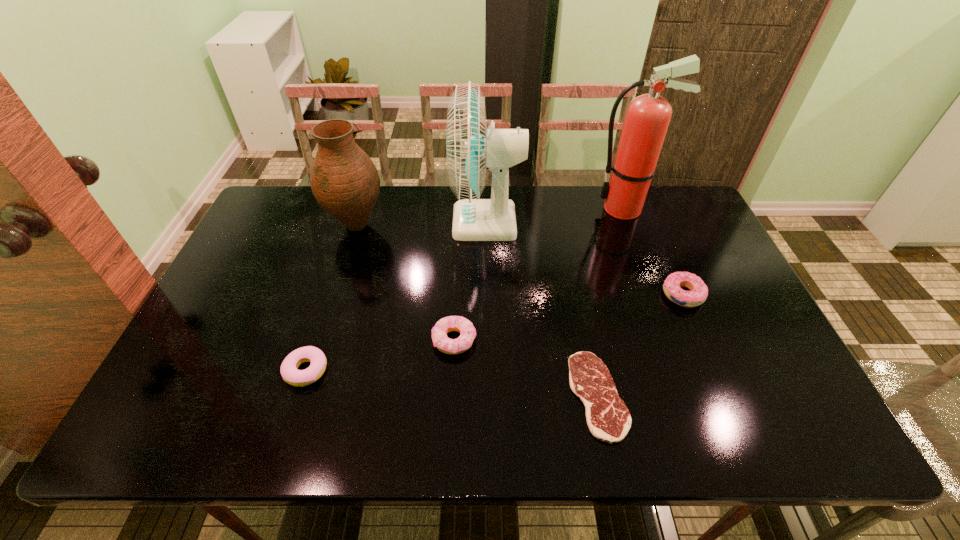
I want to click on vacant area located on the hose direction of the fire extinguisher, so click(x=486, y=209).

The width and height of the screenshot is (960, 540). I want to click on vacant region located 0.070m on the hose direction of the fire extinguisher, so click(x=569, y=209).

This screenshot has height=540, width=960. I want to click on vacant area located in front of the fan to face the airflow, so (335, 222).

I want to click on free spot located 0.390m in front of the fan to face the airflow, so click(x=332, y=222).

The width and height of the screenshot is (960, 540). Find the location of `free space located 0.390m in front of the fan to face the airflow`. free space located 0.390m in front of the fan to face the airflow is located at coordinates (332, 222).

Where is `free space located on the right of the vase`? This screenshot has height=540, width=960. free space located on the right of the vase is located at coordinates (419, 225).

What are the coordinates of `vacant space situated 0.320m on the front of the fourth farthest object` in the screenshot? It's located at (738, 425).

You are a GUI agent. You are given a task and a screenshot of the screen. Output one action in this format:
    pyautogui.click(x=<x>, y=<y>)
    Task: Click on the free region located on the front of the second doughnut from left to right
    
    Given the screenshot: What is the action you would take?
    pyautogui.click(x=450, y=413)

The image size is (960, 540). I want to click on blank space located on the right of the leftmost doughnut, so click(358, 370).

Where is `vacant region located on the back of the shortest object`? vacant region located on the back of the shortest object is located at coordinates (577, 293).